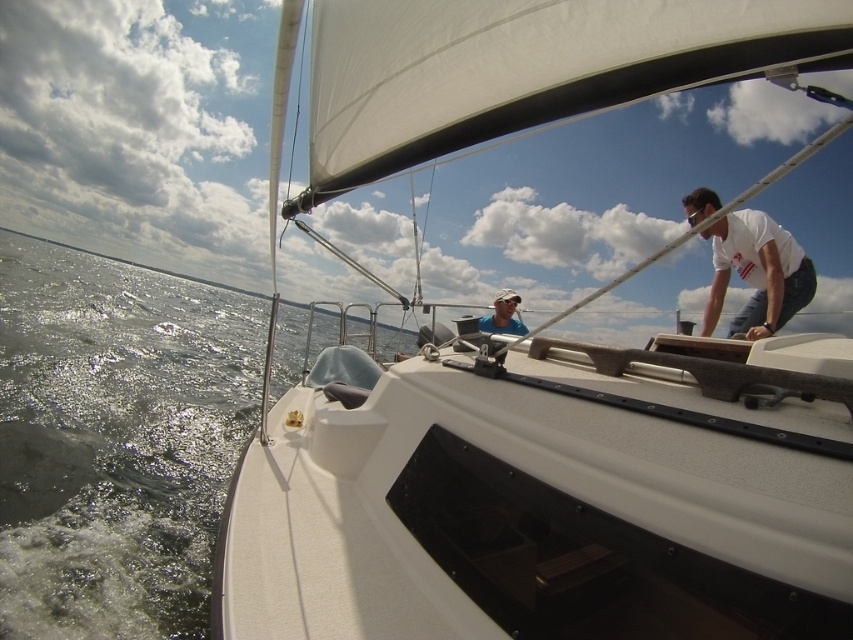
Question: Among these points, which one is nearest to the camera?

Choices:
 (A) (752, 241)
 (B) (74, 342)
 (C) (480, 323)

Answer: (A)

Question: Estimate the real-world distances between objects in this image. Which object is closer to the greenish water at lower left?

Choices:
 (A) white cotton shirt at upper right
 (B) matte blue shirt at center

Answer: (B)

Question: Is white cotton shirt at upper right above matte blue shirt at center?

Choices:
 (A) no
 (B) yes

Answer: (B)

Question: Can you confirm if white cotton shirt at upper right is positioned above matte blue shirt at center?

Choices:
 (A) yes
 (B) no

Answer: (A)

Question: Which object appears farthest from the camera in this image?

Choices:
 (A) greenish water at lower left
 (B) matte blue shirt at center
 (C) white cotton shirt at upper right

Answer: (B)

Question: Considering the relative positions of greenish water at lower left and matte blue shirt at center in the image provided, where is greenish water at lower left located with respect to matte blue shirt at center?

Choices:
 (A) below
 (B) above

Answer: (B)